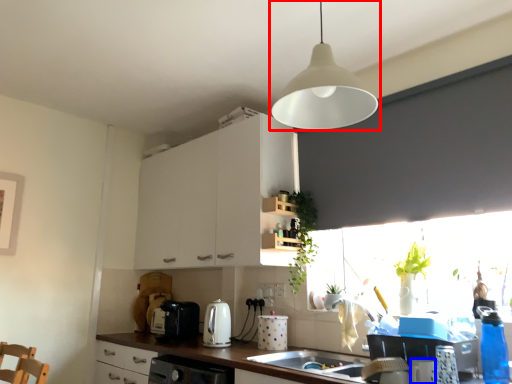
Question: Which of the following is the farthest to the observer, lamp (highlighted by a red box) or appliance (highlighted by a blue box)?

Choices:
 (A) lamp
 (B) appliance

Answer: (B)